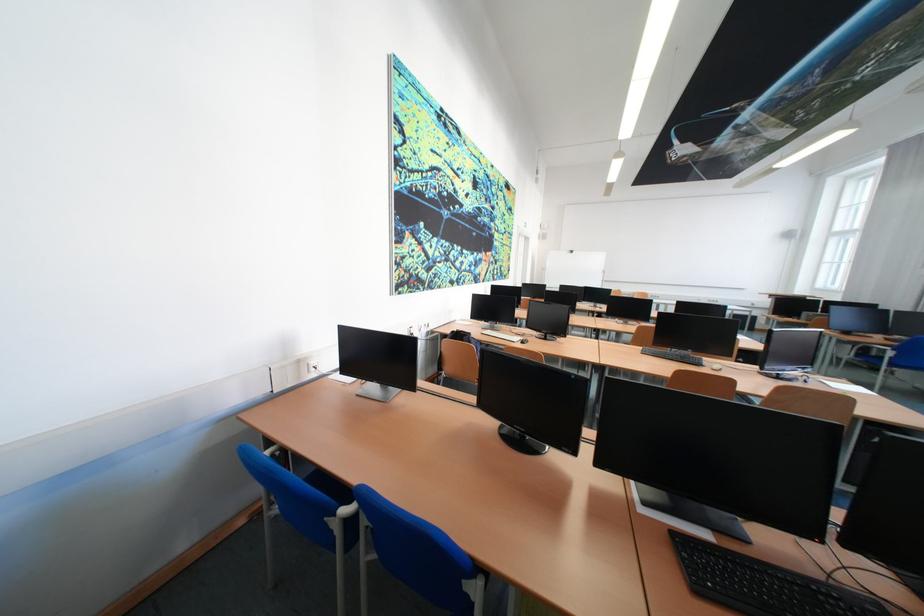
Find where to plugging in the white power outlet. Please return your answer as a coordinate pair (x, y).

(312, 367)